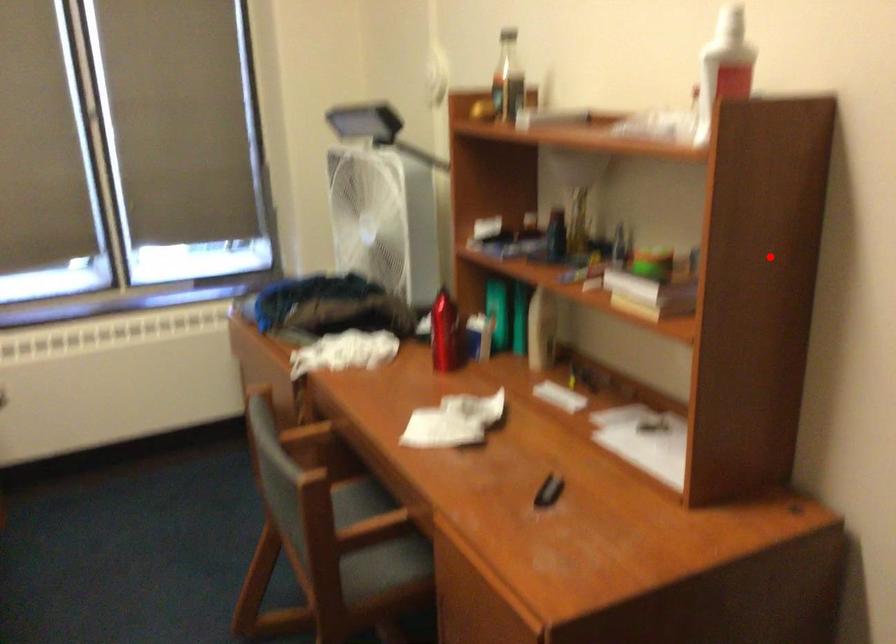
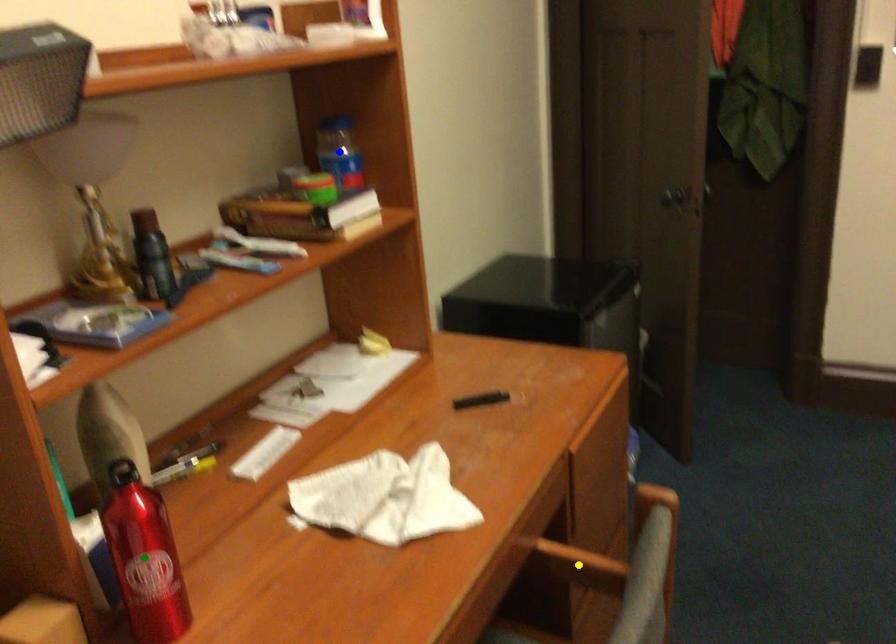
Question: I am providing you with two images of the same scene from different viewpoints. A red point is marked on the first image. You are given multiple points on the second image. Which mark in image 2 goes with the point in image 1?

Choices:
 (A) yellow point
 (B) blue point
 (C) green point

Answer: (B)